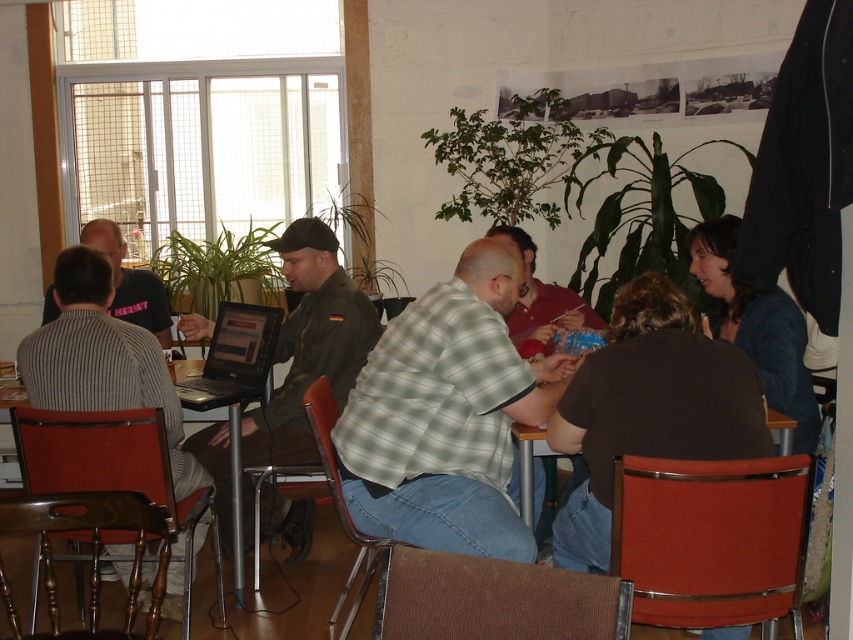
Looking at this image, which is more to the left, green plaid shirt at center or striped knit sweater at left?

From the viewer's perspective, striped knit sweater at left appears more on the left side.

In the scene shown: Is green plaid shirt at center below striped knit sweater at left?

Yes.

The height and width of the screenshot is (640, 853). What do you see at coordinates (447, 416) in the screenshot?
I see `green plaid shirt at center` at bounding box center [447, 416].

Where is `green plaid shirt at center`? green plaid shirt at center is located at coordinates (447, 416).

Based on the photo, does green plaid shirt at center have a greater width compared to matte green shirt at center?

Yes.

Does point (425, 346) lie behind point (526, 339)?

No, it is not.

At what (x,y) coordinates should I click in order to perform the action: click on green plaid shirt at center. Please return your answer as a coordinate pair (x, y). The image size is (853, 640). Looking at the image, I should click on (447, 416).

You are a GUI agent. You are given a task and a screenshot of the screen. Output one action in this format:
    pyautogui.click(x=<x>, y=<y>)
    Task: Click on the green plaid shirt at center
    The height and width of the screenshot is (640, 853).
    Given the screenshot: What is the action you would take?
    pyautogui.click(x=447, y=416)

Which is below, green plaid shirt at center or olive green uniform at center?

olive green uniform at center is lower down.

Consider the image. Can you confirm if green plaid shirt at center is positioned below olive green uniform at center?

Incorrect, green plaid shirt at center is not positioned below olive green uniform at center.

Does point (515, 353) come closer to viewer compared to point (363, 310)?

That is True.

Image resolution: width=853 pixels, height=640 pixels. I want to click on green plaid shirt at center, so click(x=447, y=416).